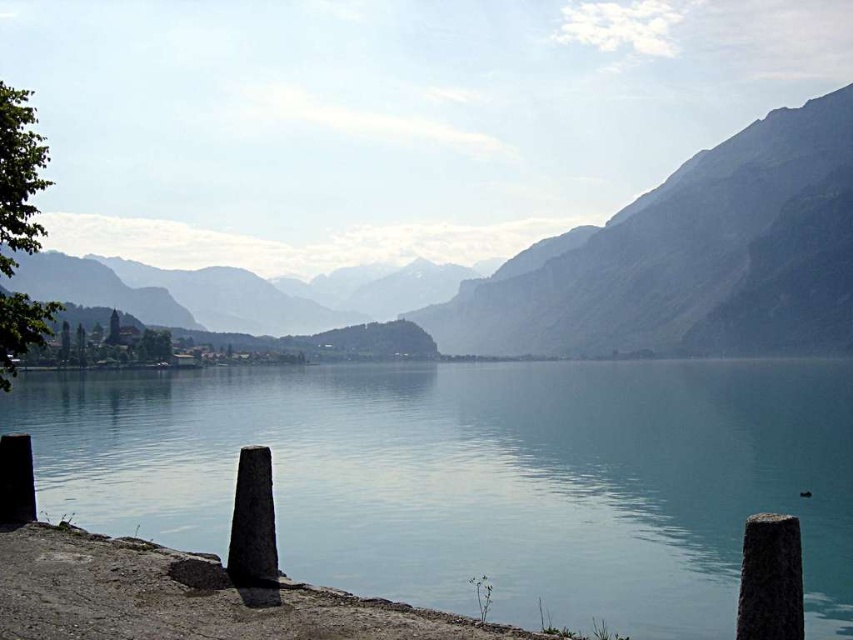
From the picture: Can you confirm if rocky gray mountain at center is smaller than gray stone post at lower left?

No, rocky gray mountain at center is not smaller than gray stone post at lower left.

Can you confirm if rocky gray mountain at center is bigger than gray stone post at lower left?

Yes.

What do you see at coordinates (686, 259) in the screenshot?
I see `rocky gray mountain at center` at bounding box center [686, 259].

I want to click on rocky gray mountain at center, so click(686, 259).

Is smooth concrete posts at lower center smaller than rocky gray mountain at center?

Yes.

Does smooth concrete posts at lower center appear on the left side of rocky gray mountain at center?

In fact, smooth concrete posts at lower center is to the right of rocky gray mountain at center.

Identify the location of smooth concrete posts at lower center. (477, 477).

You are a GUI agent. You are given a task and a screenshot of the screen. Output one action in this format:
    pyautogui.click(x=<x>, y=<y>)
    Task: Click on the smooth concrete posts at lower center
    The width and height of the screenshot is (853, 640).
    Given the screenshot: What is the action you would take?
    pyautogui.click(x=477, y=477)

Does smooth concrete posts at lower center have a smaller size compared to gray stone post at lower left?

No, smooth concrete posts at lower center is not smaller than gray stone post at lower left.

Is smooth concrete posts at lower center bigger than gray stone post at lower left?

Yes, smooth concrete posts at lower center is bigger than gray stone post at lower left.

Which is behind, point (581, 412) or point (178, 614)?

Point (581, 412)

You are a GUI agent. You are given a task and a screenshot of the screen. Output one action in this format:
    pyautogui.click(x=<x>, y=<y>)
    Task: Click on the smooth concrete posts at lower center
    This screenshot has height=640, width=853.
    Given the screenshot: What is the action you would take?
    pyautogui.click(x=477, y=477)